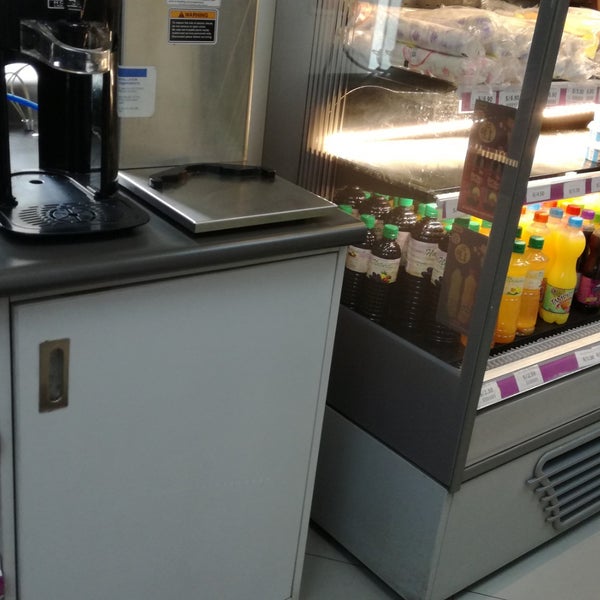
Where is `vent at bottom of refridgerated shelving unit`? vent at bottom of refridgerated shelving unit is located at coordinates (580, 481).